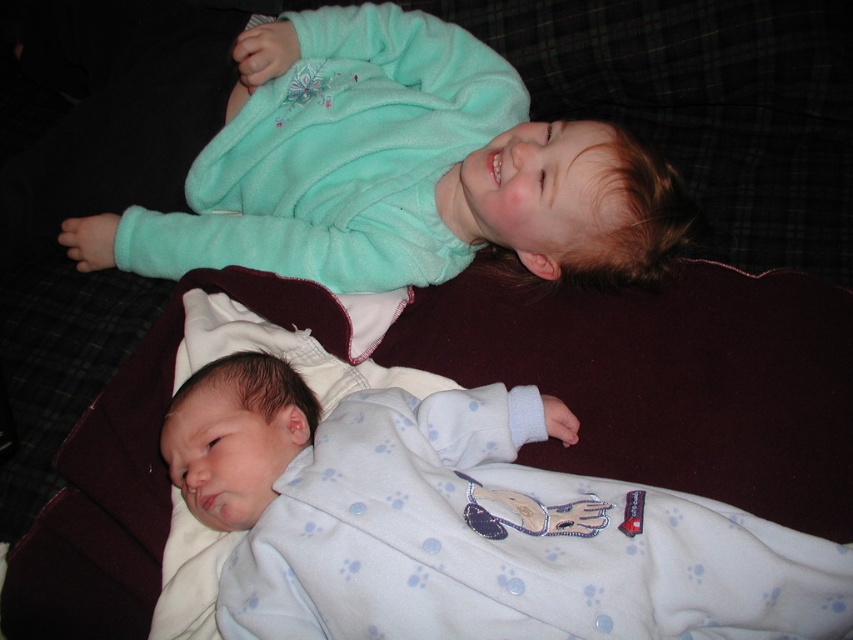
Question: Does white soft bed at upper center come in front of white fleece blanket at lower left?

Choices:
 (A) no
 (B) yes

Answer: (A)

Question: Which object is positioned closest to the white fleece blanket at lower left?

Choices:
 (A) teal fleece jacket at upper center
 (B) white soft bed at upper center

Answer: (B)

Question: Does white soft bed at upper center have a greater width compared to teal fleece jacket at upper center?

Choices:
 (A) yes
 (B) no

Answer: (A)

Question: In this image, where is white fleece blanket at lower left located relative to teal fleece jacket at upper center?

Choices:
 (A) below
 (B) above

Answer: (A)

Question: Which point is farther from the camera taking this photo?

Choices:
 (A) [332, 320]
 (B) [556, 579]
 (C) [328, 259]

Answer: (C)

Question: Which object is closer to the camera taking this photo?

Choices:
 (A) white soft bed at upper center
 (B) white fleece blanket at lower left

Answer: (B)